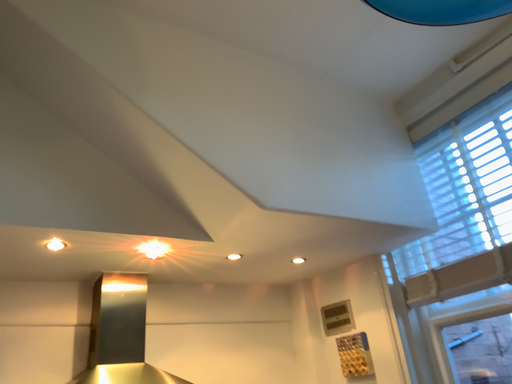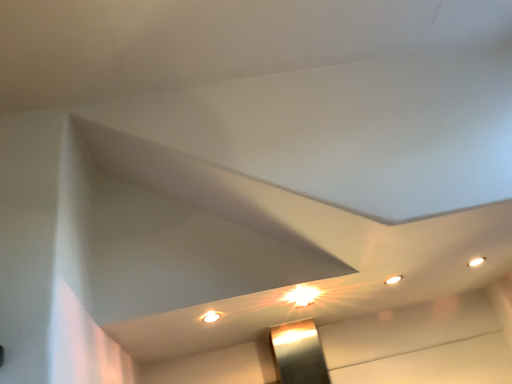
Question: Which way did the camera rotate in the video?

Choices:
 (A) rotated right
 (B) rotated left

Answer: (B)